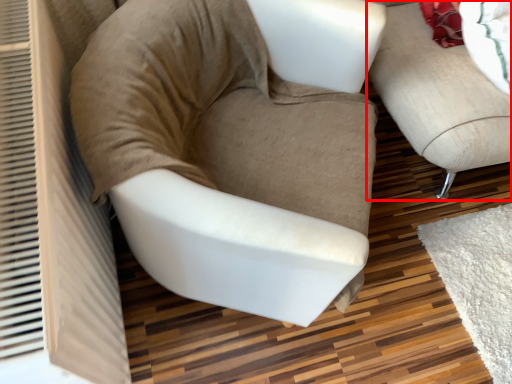
Question: From the image's perspective, what is the correct spatial relationship of studio couch (annotated by the red box) in relation to chair?

Choices:
 (A) below
 (B) above

Answer: (B)